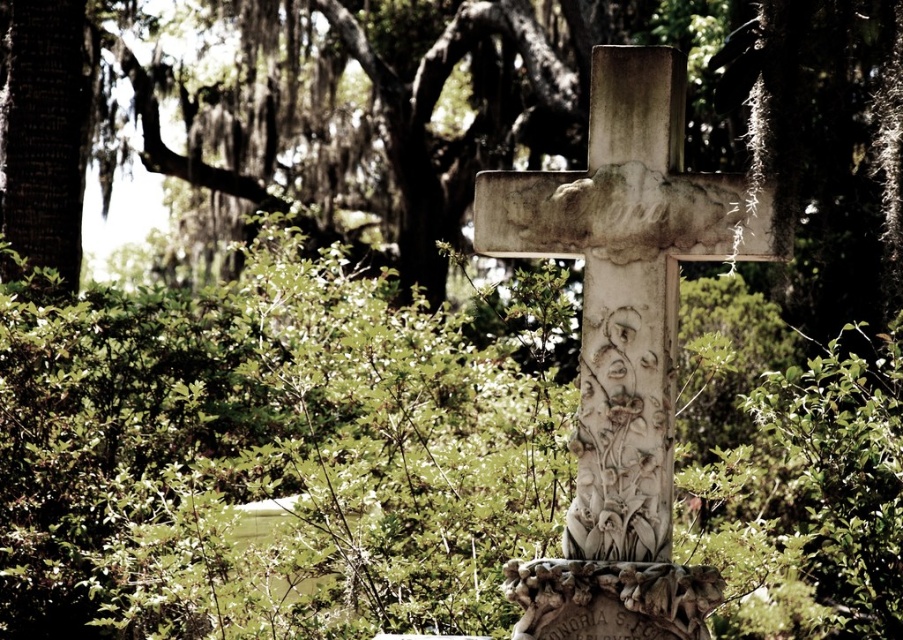
You are a gardener who needs to trim the green leafy bush at center and the carved stone gravestone at center. Which object requires more attention due to its size?

The green leafy bush at center requires more attention because it has a larger size compared to the carved stone gravestone at center.

You are standing in a natural setting with a stone cross and some greenery. You see a green leafy bush at center and a carved stone gravestone at center. Which object is positioned higher in the scene?

The green leafy bush at center is located above the carved stone gravestone at center, so it is positioned higher in the scene.